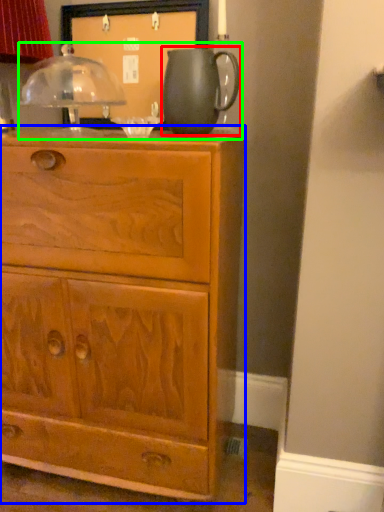
Question: Considering the real-world distances, which object is closest to jug (highlighted by a red box)? chest of drawers (highlighted by a blue box) or tea set (highlighted by a green box).

Choices:
 (A) chest of drawers
 (B) tea set

Answer: (B)